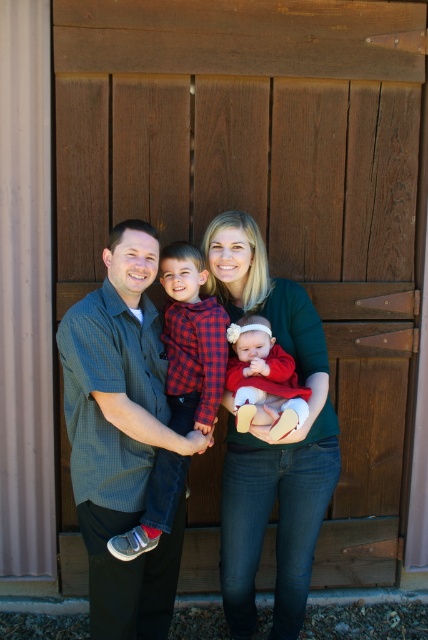
Question: Which of the following is the farthest from the observer?

Choices:
 (A) (315, 525)
 (B) (249, 387)

Answer: (A)

Question: Can you confirm if green checkered shirt at center is positioned to the right of red plaid shirt at center?

Choices:
 (A) yes
 (B) no

Answer: (B)

Question: Which object is the farthest from the matte red dress at center?

Choices:
 (A) red plaid shirt at center
 (B) matte green sweater at center
 (C) green checkered shirt at center

Answer: (C)

Question: Observing the image, what is the correct spatial positioning of green checkered shirt at center in reference to red plaid shirt at center?

Choices:
 (A) below
 (B) above

Answer: (A)

Question: Which point is farther to the camera?

Choices:
 (A) red plaid shirt at center
 (B) matte red dress at center
 (C) matte green sweater at center
 (D) green checkered shirt at center

Answer: (A)

Question: Is green checkered shirt at center behind red plaid shirt at center?

Choices:
 (A) yes
 (B) no

Answer: (B)